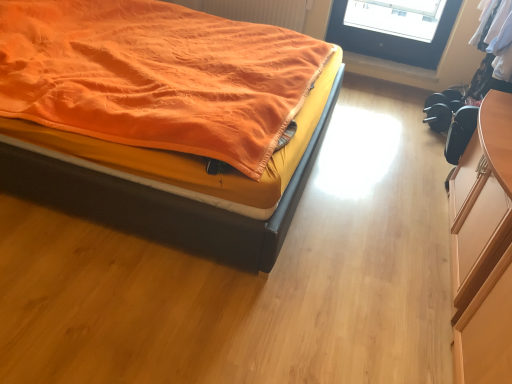
Where is `free spot above wooden at lower right (from a real-world perspective)`? The image size is (512, 384). free spot above wooden at lower right (from a real-world perspective) is located at coordinates (389, 61).